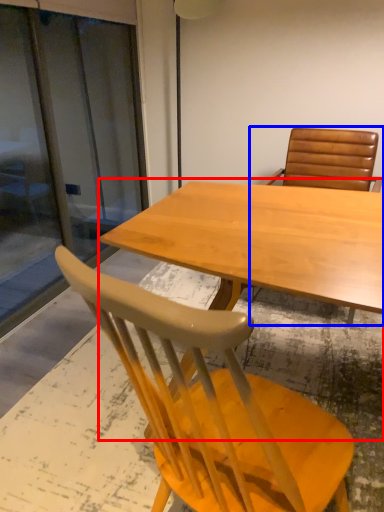
Question: Which point is closer to the camera, table (highlighted by a red box) or chair (highlighted by a blue box)?

Choices:
 (A) table
 (B) chair

Answer: (A)